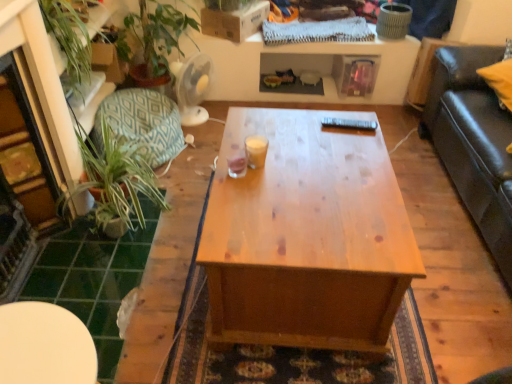
What is the approximate width of green tile at lower left?

20.93 inches.

I want to click on teal fabric cushion at left, so click(142, 123).

Describe the element at coordinates (237, 162) in the screenshot. This screenshot has width=512, height=384. I see `translucent glass at center, which appears as the 1th coffee cup when viewed from the left` at that location.

Where is `translucent glass at center, which appears as the 1th coffee cup when viewed from the left`? The width and height of the screenshot is (512, 384). translucent glass at center, which appears as the 1th coffee cup when viewed from the left is located at coordinates pos(237,162).

Where is `green textured plant at lower left`? green textured plant at lower left is located at coordinates (117, 177).

Locate an element on the screen. This screenshot has height=384, width=512. green tile at lower left is located at coordinates (93, 279).

At what (x,y) coordinates should I click in order to perform the action: click on houseplant below the white glossy table at lower left (from a real-world perspective). Please return your answer as a coordinate pair (x, y). Looking at the image, I should click on (117, 177).

From the image's perspective, is white glossy table at lower left over green textured plant at lower left?

No, from the image's perspective, white glossy table at lower left is not over green textured plant at lower left.

In the image, is white glossy table at lower left positioned in front of or behind green textured plant at lower left?

In the image, white glossy table at lower left appears in front of green textured plant at lower left.

Are white glossy table at lower left and green textured plant at lower left beside each other?

No, white glossy table at lower left is not touching green textured plant at lower left.

From a real-world perspective, does green textured plant at lower left stand above teal fabric cushion at left?

Yes, from a real-world perspective, green textured plant at lower left is on top of teal fabric cushion at left.

Can you tell me how much green textured plant at lower left and teal fabric cushion at left differ in facing direction?

green textured plant at lower left and teal fabric cushion at left are facing 1.93 degrees away from each other.

Considering the sizes of objects green textured plant at lower left and teal fabric cushion at left in the image provided, who is wider, green textured plant at lower left or teal fabric cushion at left?

With larger width is green textured plant at lower left.

Does green textured plant at lower left have a smaller size compared to teal fabric cushion at left?

Actually, green textured plant at lower left might be larger than teal fabric cushion at left.

Is white glossy table at lower left not near wooden coffee table at center?

white glossy table at lower left is near wooden coffee table at center, not far away.

Between white glossy table at lower left and wooden coffee table at center, which one has smaller width?

white glossy table at lower left is thinner.

Is wooden coffee table at center located within white glossy table at lower left?

No, wooden coffee table at center is located outside of white glossy table at lower left.

Based on their positions, is white glossy table at lower left located to the left or right of wooden coffee table at center?

From the image, it's evident that white glossy table at lower left is to the left of wooden coffee table at center.

Is translucent glass at center, which appears as the 1th coffee cup when viewed from the left, not within wooden coffee table at center?

translucent glass at center, which appears as the 1th coffee cup when viewed from the left, is positioned outside wooden coffee table at center.

Are translucent glass at center, which ranks as the second coffee cup in right-to-left order, and wooden coffee table at center located far from each other?

They are positioned close to each other.

Is translucent glass at center, which ranks as the second coffee cup in right-to-left order, to the right of wooden coffee table at center from the viewer's perspective?

In fact, translucent glass at center, which ranks as the second coffee cup in right-to-left order, is to the left of wooden coffee table at center.

Looking at this image, which of these two, green textured plant at lower left or white glossy table at lower left, is smaller?

With smaller size is white glossy table at lower left.

Considering the points (150, 187) and (22, 342), which point is behind, point (150, 187) or point (22, 342)?

The point (150, 187) is farther from the camera.

From the image's perspective, is green textured plant at lower left above or below white glossy table at lower left?

Based on their image positions, green textured plant at lower left is located above white glossy table at lower left.

Locate an element on the screen. houseplant to the left of white glossy table at lower left is located at coordinates (117, 177).

Which object is more forward, green tile at lower left or translucent glass at center, which appears as the 1th coffee cup when viewed from the left?

translucent glass at center, which appears as the 1th coffee cup when viewed from the left.

Is point (55, 291) farther from camera compared to point (233, 145)?

Yes, it is behind point (233, 145).

Which of these two, green tile at lower left or translucent glass at center, which appears as the 1th coffee cup when viewed from the left, is smaller?

Smaller between the two is translucent glass at center, which appears as the 1th coffee cup when viewed from the left.

Could you tell me if green tile at lower left is turned towards translucent glass at center, which ranks as the second coffee cup in right-to-left order?

No, green tile at lower left does not turn towards translucent glass at center, which ranks as the second coffee cup in right-to-left order.

Can you confirm if translucent glass cup at center, the 2th coffee cup in the left-to-right sequence, is thinner than green textured plant at lower left?

Correct, the width of translucent glass cup at center, the 2th coffee cup in the left-to-right sequence, is less than that of green textured plant at lower left.

From the image's perspective, is translucent glass cup at center, the 2th coffee cup in the left-to-right sequence, located above or below green textured plant at lower left?

Based on their image positions, translucent glass cup at center, the 2th coffee cup in the left-to-right sequence, is located above green textured plant at lower left.

Considering the sizes of objects translucent glass cup at center, the 2th coffee cup in the left-to-right sequence, and green textured plant at lower left in the image provided, who is bigger, translucent glass cup at center, the 2th coffee cup in the left-to-right sequence, or green textured plant at lower left?

green textured plant at lower left.

I want to click on houseplant above the white glossy table at lower left (from the image's perspective), so click(117, 177).

Image resolution: width=512 pixels, height=384 pixels. I want to click on houseplant located on the left of teal fabric cushion at left, so click(117, 177).

Estimate the real-world distances between objects in this image. Which object is closer to translucent glass at center, which appears as the 1th coffee cup when viewed from the left, white glossy table at lower left or wooden coffee table at center?

wooden coffee table at center is positioned closer to the anchor translucent glass at center, which appears as the 1th coffee cup when viewed from the left.

Looking at the image, which one is located further to translucent glass at center, which ranks as the second coffee cup in right-to-left order, green tile at lower left or white glossy table at lower left?

Among the two, green tile at lower left is located further to translucent glass at center, which ranks as the second coffee cup in right-to-left order.

From the image, which object appears to be nearer to green textured plant at lower left, white glossy table at lower left or wooden coffee table at center?

wooden coffee table at center is positioned closer to the anchor green textured plant at lower left.

When comparing their distances from teal fabric cushion at left, does translucent glass cup at center, the 2th coffee cup in the left-to-right sequence, or white glossy table at lower left seem further?

white glossy table at lower left is further to teal fabric cushion at left.

Which object lies further to the anchor point translucent glass cup at center, marked as the 1th coffee cup in a right-to-left arrangement, wooden coffee table at center or translucent glass at center, which ranks as the second coffee cup in right-to-left order?

wooden coffee table at center.

Which object lies further to the anchor point translucent glass at center, which appears as the 1th coffee cup when viewed from the left, green tile at lower left or green textured plant at lower left?

green tile at lower left is further to translucent glass at center, which appears as the 1th coffee cup when viewed from the left.

Looking at this image, looking at the image, which one is located closer to translucent glass cup at center, marked as the 1th coffee cup in a right-to-left arrangement, green tile at lower left or white glossy table at lower left?

The object closer to translucent glass cup at center, marked as the 1th coffee cup in a right-to-left arrangement, is green tile at lower left.

When comparing their distances from teal fabric cushion at left, does white glossy table at lower left or green tile at lower left seem closer?

green tile at lower left lies closer to teal fabric cushion at left than the other object.

Find the location of a particular element. tile between translucent glass at center, which ranks as the second coffee cup in right-to-left order, and teal fabric cushion at left in the front-back direction is located at coordinates (93, 279).

Locate an element on the screen. The width and height of the screenshot is (512, 384). coffee cup positioned between green tile at lower left and teal fabric cushion at left from near to far is located at coordinates 256,151.

Where is `coffee cup positioned between wooden coffee table at center and translucent glass cup at center, the 2th coffee cup in the left-to-right sequence, from near to far`? The image size is (512, 384). coffee cup positioned between wooden coffee table at center and translucent glass cup at center, the 2th coffee cup in the left-to-right sequence, from near to far is located at coordinates (237, 162).

Locate an element on the screen. The image size is (512, 384). houseplant situated between green tile at lower left and translucent glass cup at center, the 2th coffee cup in the left-to-right sequence, from left to right is located at coordinates (117, 177).